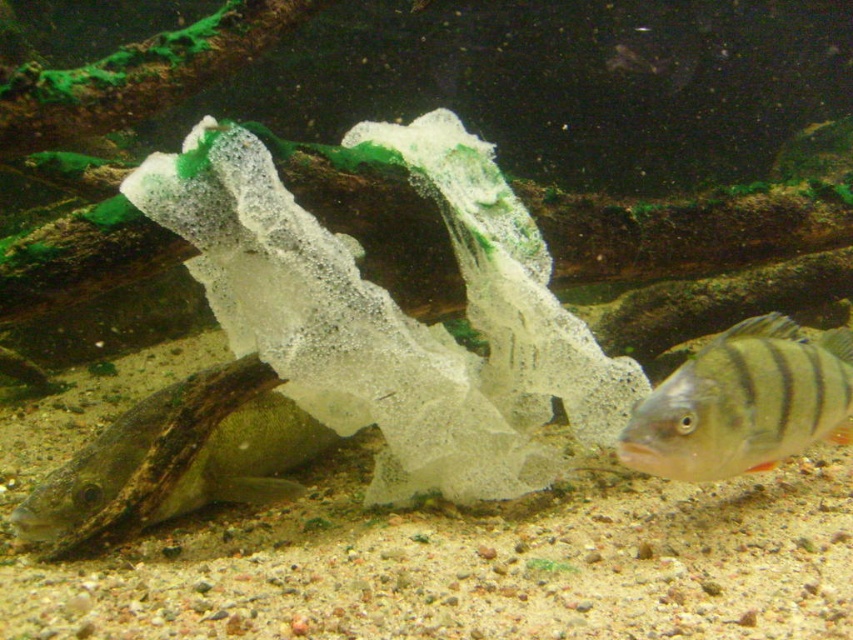
Is smooth brown fish at lower left below shiny silver fish at lower right?

Yes.

Is smooth brown fish at lower left bigger than shiny silver fish at lower right?

Yes.

Locate an element on the screen. smooth brown fish at lower left is located at coordinates (175, 460).